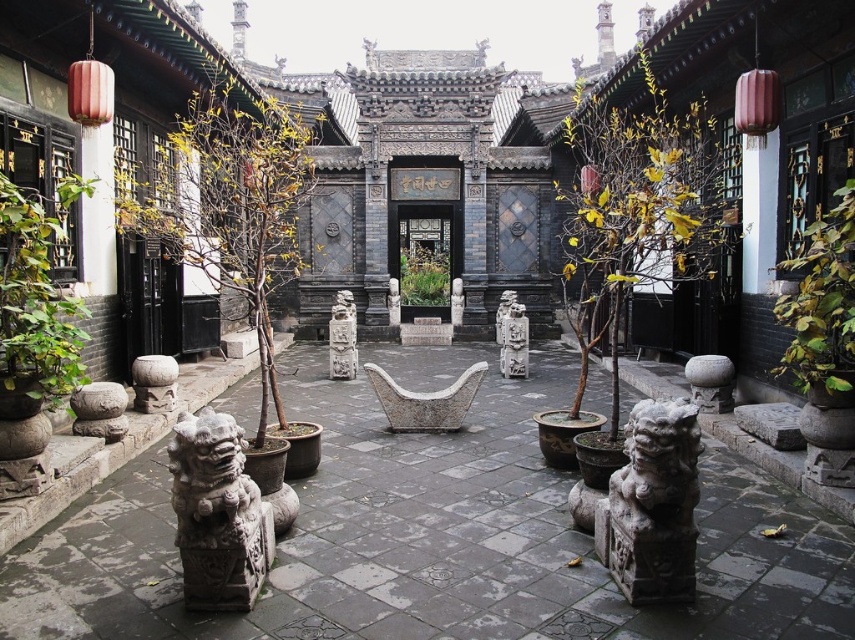
Question: Estimate the real-world distances between objects in this image. Which object is closer to the gray stone head at lower left?

Choices:
 (A) gray stone statue at center
 (B) gray stone lion at center

Answer: (A)

Question: Can you confirm if green leafy plant at right is positioned below white stone statue at center?

Choices:
 (A) yes
 (B) no

Answer: (B)

Question: Can you confirm if stone statue at lower left is positioned to the right of gray stone statue at center?

Choices:
 (A) no
 (B) yes

Answer: (A)

Question: Based on their relative distances, which object is nearer to the brown bark tree at center?

Choices:
 (A) gray stone lion at lower left
 (B) gray stone statue at center

Answer: (A)

Question: Can you confirm if yellow-green leaves at center is positioned to the right of stone statue at lower left?

Choices:
 (A) yes
 (B) no

Answer: (A)

Question: Which of the following is the closest to the observer?

Choices:
 (A) green leafy plant at left
 (B) white stone statue at center
 (C) gray stone head at lower left
 (D) gray stone lion at lower center

Answer: (D)